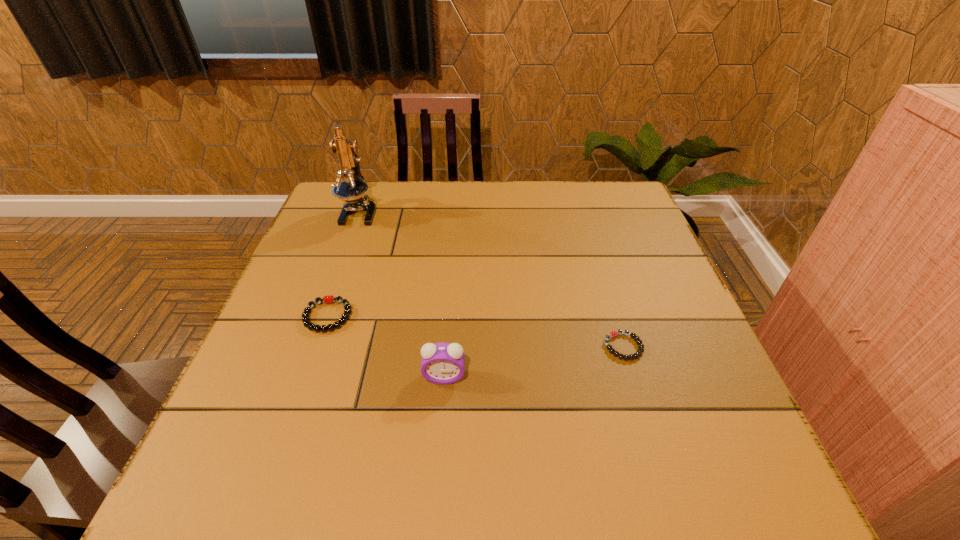
At what (x,y) coordinates should I click in order to perform the action: click on vacant space situated 0.050m on the back of the left bracelet. Please return your answer as a coordinate pair (x, y). Image resolution: width=960 pixels, height=540 pixels. Looking at the image, I should click on coord(339,285).

This screenshot has width=960, height=540. Identify the location of vacant position located on the back of the rightmost object. (600, 272).

Identify the location of object that is at the far edge. (353, 190).

Where is `microscope positioned at the left edge`? microscope positioned at the left edge is located at coordinates (353, 190).

Locate an element on the screen. The height and width of the screenshot is (540, 960). bracelet positioned at the left edge is located at coordinates (328, 299).

Find the location of `object that is at the right edge`. object that is at the right edge is located at coordinates (612, 334).

Locate an element on the screen. object present at the far left corner is located at coordinates (353, 190).

This screenshot has height=540, width=960. I want to click on free space at the far edge of the desktop, so click(543, 183).

This screenshot has height=540, width=960. Identify the location of free region at the left edge of the desktop. (309, 345).

In the image, there is a desktop. Where is `free space at the right edge`? This screenshot has height=540, width=960. free space at the right edge is located at coordinates (706, 355).